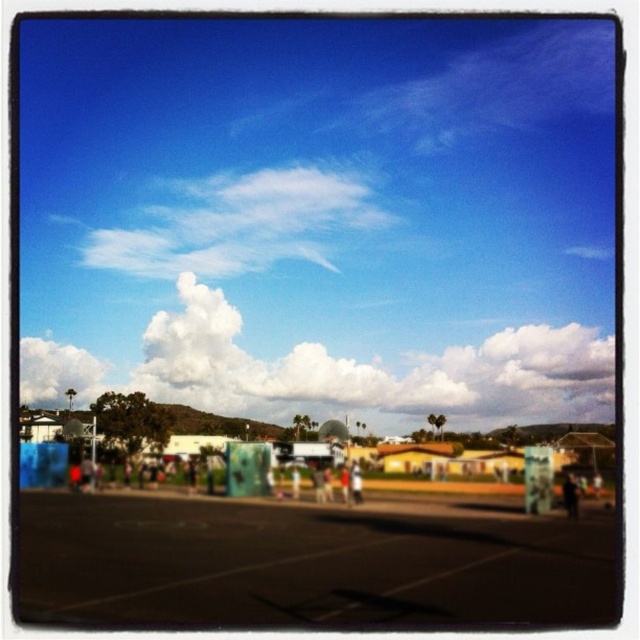
You are planning to launch a small weather balloon that can travel up to 35 meters high. Based on the image, will the balloon reach the white fluffy cloud at upper center before the white fluffy cloud at upper left?

The distance between the white fluffy cloud at upper center and white fluffy cloud at upper left is 37.96 meters. Since the balloon can only travel up to 35 meters, it will not reach either cloud.